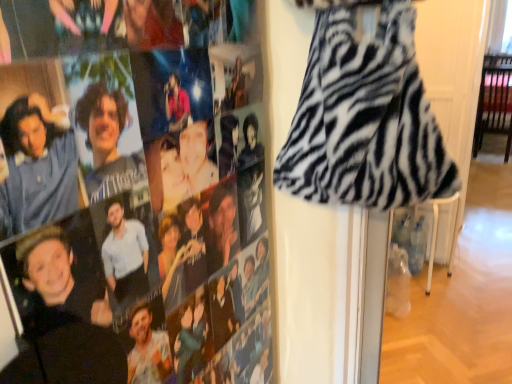
The image size is (512, 384). Describe the element at coordinates (133, 212) in the screenshot. I see `zebra print dress at right` at that location.

You are a GUI agent. You are given a task and a screenshot of the screen. Output one action in this format:
    pyautogui.click(x=<x>, y=<y>)
    Task: Click on the zebra print dress at right
    
    Given the screenshot: What is the action you would take?
    pyautogui.click(x=133, y=212)

What is the approximate width of zebra print fur dress at right?

The width of zebra print fur dress at right is 5.71 inches.

This screenshot has width=512, height=384. In order to click on zebra print fur dress at right in this screenshot , I will do `click(365, 118)`.

Image resolution: width=512 pixels, height=384 pixels. What do you see at coordinates (365, 118) in the screenshot?
I see `zebra print fur dress at right` at bounding box center [365, 118].

Where is `zebra print dress at right`? The image size is (512, 384). zebra print dress at right is located at coordinates click(133, 212).

Does zebra print dress at right appear on the right side of zebra print fur dress at right?

In fact, zebra print dress at right is to the left of zebra print fur dress at right.

From the picture: Is zebra print dress at right closer to camera compared to zebra print fur dress at right?

Yes, it is in front of zebra print fur dress at right.

Which point is more distant from viewer, (260, 92) or (425, 153)?

The point (260, 92) is behind.

From the image's perspective, is zebra print dress at right under zebra print fur dress at right?

Yes, from the image's perspective, zebra print dress at right is below zebra print fur dress at right.

From a real-world perspective, who is located higher, zebra print dress at right or zebra print fur dress at right?

In real-world perspective, zebra print fur dress at right is above.

Which object is thinner, zebra print dress at right or zebra print fur dress at right?

With smaller width is zebra print dress at right.

Considering the sizes of zebra print dress at right and zebra print fur dress at right in the image, is zebra print dress at right taller or shorter than zebra print fur dress at right?

zebra print dress at right is taller than zebra print fur dress at right.

Which of these two, zebra print dress at right or zebra print fur dress at right, is smaller?

Smaller between the two is zebra print dress at right.

Would you say zebra print dress at right is outside zebra print fur dress at right?

Yes, zebra print dress at right is outside of zebra print fur dress at right.

Is zebra print dress at right with zebra print fur dress at right?

No, zebra print dress at right is not touching zebra print fur dress at right.

Is zebra print dress at right looking in the opposite direction of zebra print fur dress at right?

No, zebra print dress at right is not facing away from zebra print fur dress at right.

Based on the photo, can you tell me how much zebra print dress at right and zebra print fur dress at right differ in facing direction?

They differ by 81.3 degrees in their facing directions.

How far apart are zebra print dress at right and zebra print fur dress at right?

zebra print dress at right and zebra print fur dress at right are 8.89 inches apart from each other.

Where is `fancy dress above the zebra print dress at right (from a real-world perspective)`? The height and width of the screenshot is (384, 512). fancy dress above the zebra print dress at right (from a real-world perspective) is located at coordinates (365, 118).

Consider the image. Considering the positions of objects zebra print fur dress at right and zebra print dress at right in the image provided, who is more to the left, zebra print fur dress at right or zebra print dress at right?

zebra print dress at right.

Is zebra print fur dress at right positioned in front of zebra print dress at right?

No, zebra print fur dress at right is further to the viewer.

Between point (331, 114) and point (134, 139), which one is positioned in front?

The point (134, 139) is more forward.

From the image's perspective, is zebra print fur dress at right on zebra print dress at right?

Indeed, from the image's perspective, zebra print fur dress at right is shown above zebra print dress at right.

From a real-world perspective, is zebra print fur dress at right physically below zebra print dress at right?

No, from a real-world perspective, zebra print fur dress at right is not beneath zebra print dress at right.

Does zebra print fur dress at right have a greater width compared to zebra print dress at right?

Yes, zebra print fur dress at right is wider than zebra print dress at right.

From the picture: Does zebra print fur dress at right have a lesser height compared to zebra print dress at right?

Correct, zebra print fur dress at right is not as tall as zebra print dress at right.

Looking at the image, does zebra print fur dress at right seem bigger or smaller compared to zebra print dress at right?

Considering their sizes, zebra print fur dress at right takes up more space than zebra print dress at right.

Looking at this image, which is correct: zebra print fur dress at right is inside zebra print dress at right, or outside of it?

zebra print fur dress at right cannot be found inside zebra print dress at right.

Would you say zebra print fur dress at right is a long distance from zebra print dress at right?

They are positioned close to each other.

Looking at this image, is zebra print dress at right at the back of zebra print fur dress at right?

No.

At what (x,y) coordinates should I click in order to perform the action: click on fancy dress above the zebra print dress at right (from a real-world perspective). Please return your answer as a coordinate pair (x, y). This screenshot has height=384, width=512. Looking at the image, I should click on (365, 118).

Locate an element on the screen. This screenshot has width=512, height=384. person lying below the zebra print fur dress at right (from the image's perspective) is located at coordinates (133, 212).

What are the coordinates of `fancy dress that appears on the right of zebra print dress at right` in the screenshot? It's located at pos(365,118).